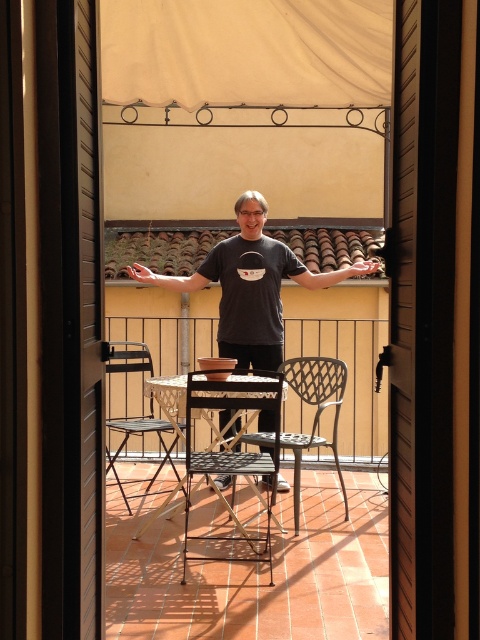
Does metallic black chair at center have a smaller size compared to matte black hand at upper center?

Actually, metallic black chair at center might be larger than matte black hand at upper center.

Does metallic black chair at center have a lesser width compared to matte black hand at upper center?

No.

Who is more distant from viewer, (170,444) or (372,272)?

The point (170,444) is behind.

Find the location of `metallic black chair at center`. metallic black chair at center is located at coordinates (141, 435).

Is point (164, 70) closer to camera compared to point (160, 275)?

Yes.

Where is `beige fabric canopy at upper center`? beige fabric canopy at upper center is located at coordinates (247, 51).

Between point (109, 92) and point (192, 280), which one is positioned in front?

Point (109, 92) is more forward.

The image size is (480, 640). Identify the location of beige fabric canopy at upper center. (247, 51).

Is dark gray t-shirt at center wider than metallic black chair at center?

Indeed, dark gray t-shirt at center has a greater width compared to metallic black chair at center.

What do you see at coordinates (251, 285) in the screenshot?
I see `dark gray t-shirt at center` at bounding box center [251, 285].

Find the location of a particular element. The width and height of the screenshot is (480, 640). dark gray t-shirt at center is located at coordinates (251, 285).